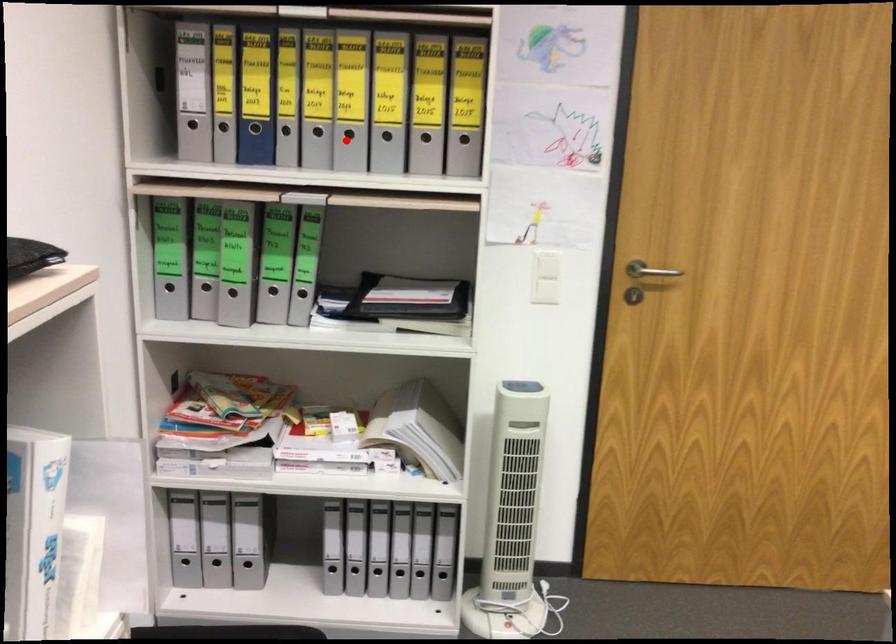
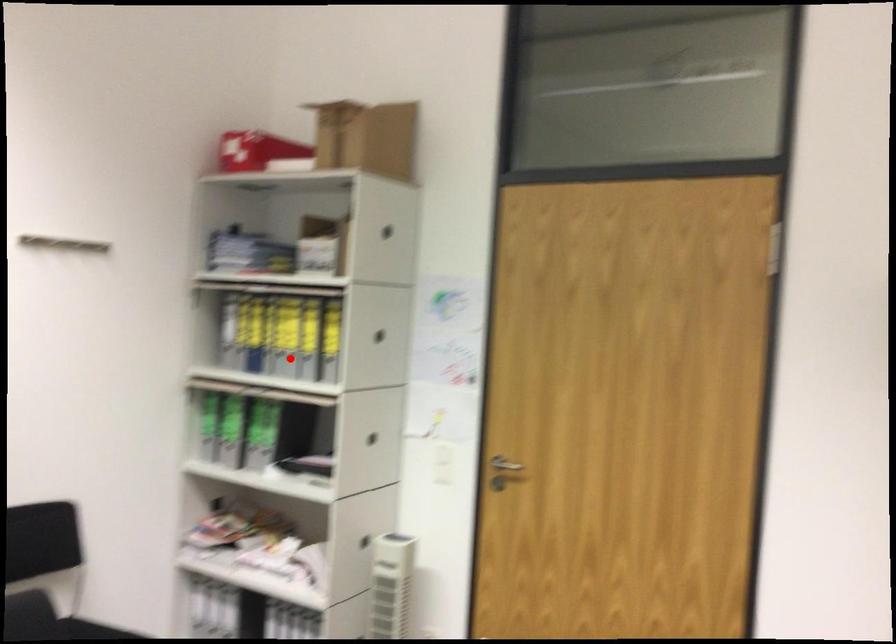
I am providing you with two images of the same scene from different viewpoints. A red point is marked on the first image and another point is marked on the second image. Do the highlighted points in image1 and image2 indicate the same real-world spot?

Yes